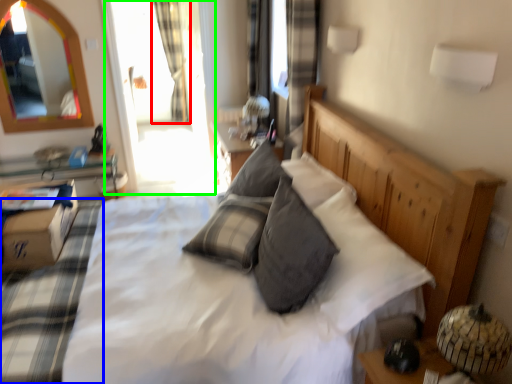
Question: Which is farther away from curtain (highlighted by a red box)? bedding (highlighted by a blue box) or glass door (highlighted by a green box)?

Choices:
 (A) bedding
 (B) glass door

Answer: (A)